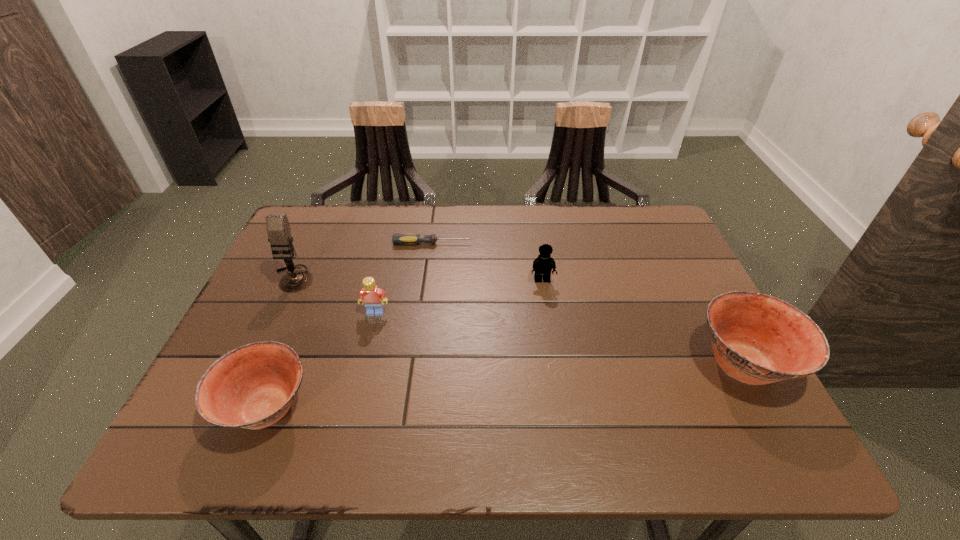
I want to click on the shorter bowl, so coord(252,387).

At what (x,y) coordinates should I click in order to perform the action: click on the rightmost object. Please return your answer as a coordinate pair (x, y). This screenshot has width=960, height=540. Looking at the image, I should click on (757, 339).

Locate an element on the screen. The width and height of the screenshot is (960, 540). the taller bowl is located at coordinates (757, 339).

At what (x,y) coordinates should I click in order to perform the action: click on the farther Lego. Please return your answer as a coordinate pair (x, y). This screenshot has height=540, width=960. Looking at the image, I should click on (542, 265).

Locate an element on the screen. the right Lego is located at coordinates (542, 265).

This screenshot has width=960, height=540. I want to click on the farthest object, so click(413, 239).

Locate an element on the screen. The image size is (960, 540). screwdriver is located at coordinates (413, 239).

Locate an element on the screen. The height and width of the screenshot is (540, 960). the tallest object is located at coordinates (278, 229).

Locate an element on the screen. Image resolution: width=960 pixels, height=540 pixels. the nearer Lego is located at coordinates (x=373, y=297).

Locate an element on the screen. The height and width of the screenshot is (540, 960). the third nearest object is located at coordinates (373, 297).